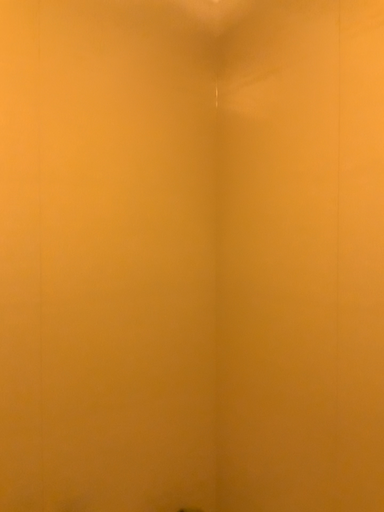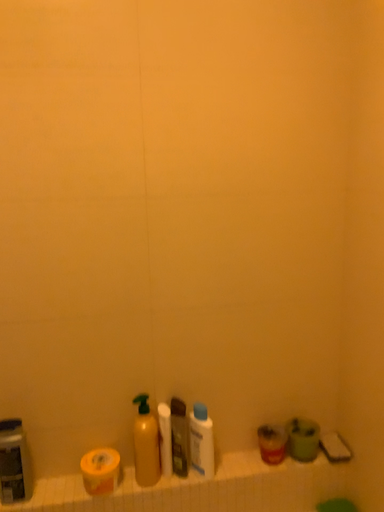
Question: Which way did the camera rotate in the video?

Choices:
 (A) rotated downward
 (B) rotated upward

Answer: (A)